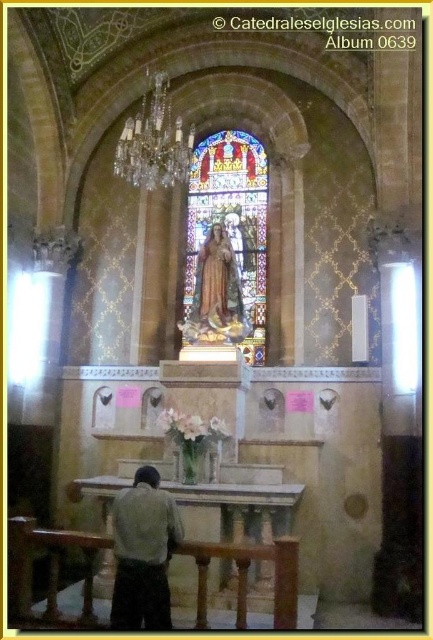
Question: Which is farther from the matte gold statue at center?

Choices:
 (A) light brown leather jacket at lower left
 (B) stained glass window at center
 (C) crystal glass chandelier at upper left

Answer: (A)

Question: Does crystal glass chandelier at upper left appear on the left side of matte gold statue at center?

Choices:
 (A) yes
 (B) no

Answer: (A)

Question: Which point is farther to the camera?

Choices:
 (A) stained glass window at center
 (B) crystal glass chandelier at upper left
 (C) matte gold statue at center

Answer: (B)

Question: Can you confirm if crystal glass chandelier at upper left is smaller than matte gold statue at center?

Choices:
 (A) yes
 (B) no

Answer: (B)

Question: Does light brown leather jacket at lower left have a lesser width compared to crystal glass chandelier at upper left?

Choices:
 (A) no
 (B) yes

Answer: (B)

Question: Which is farther from the stained glass window at center?

Choices:
 (A) matte gold statue at center
 (B) crystal glass chandelier at upper left

Answer: (B)